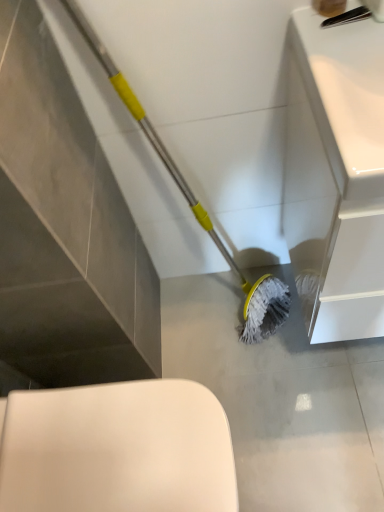
The height and width of the screenshot is (512, 384). I want to click on free location above gray matte mop head at lower center (from a real-world perspective), so click(x=254, y=367).